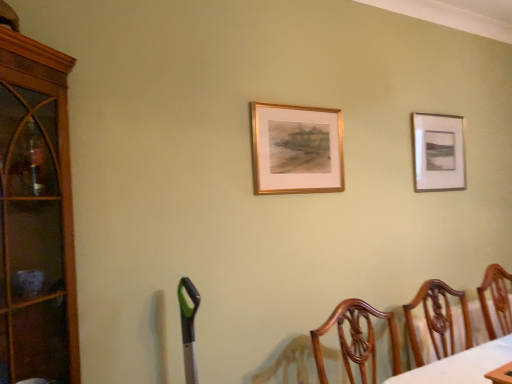
Question: In terms of size, does matte silver picture frame at upper right, the first picture frame when ordered from right to left, appear bigger or smaller than brown wood cabinet at left?

Choices:
 (A) small
 (B) big

Answer: (A)

Question: Looking at their shapes, would you say matte silver picture frame at upper right, arranged as the second picture frame when viewed from the front, is wider or thinner than brown wood cabinet at left?

Choices:
 (A) thin
 (B) wide

Answer: (A)

Question: Considering the real-world distances, which object is closest to the brown wood cabinet at left?

Choices:
 (A) matte silver picture frame at upper right, the first picture frame when ordered from right to left
 (B) wooden chair at lower right
 (C) gold metallic picture frame at center, which is the second picture frame in right-to-left order

Answer: (C)

Question: Which object is positioned farthest from the matte silver picture frame at upper right, positioned as the second picture frame in left-to-right order?

Choices:
 (A) brown wood cabinet at left
 (B) gold metallic picture frame at center, the first picture frame positioned from the front
 (C) wooden chair at lower right

Answer: (A)